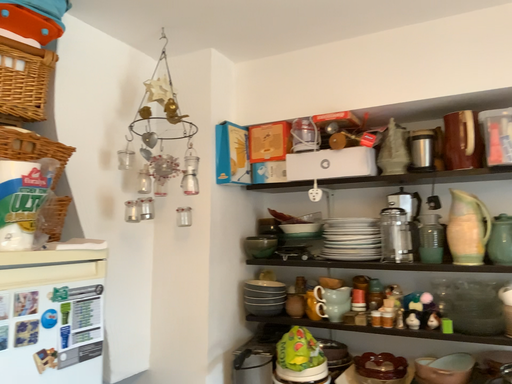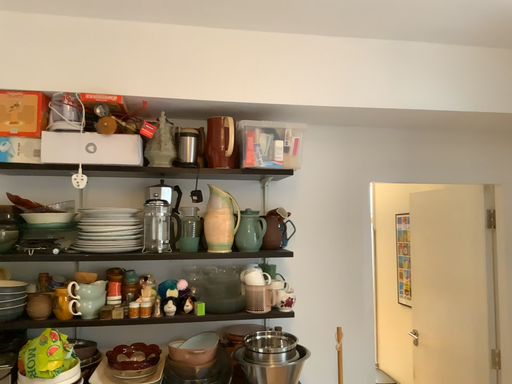
Question: How did the camera likely rotate when shooting the video?

Choices:
 (A) rotated left
 (B) rotated right

Answer: (B)